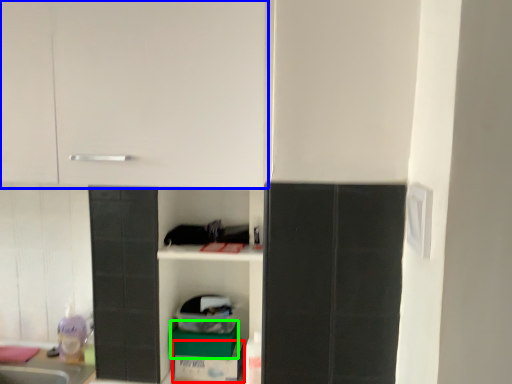
Question: Which object is positioned farthest from cardboard box (highlighted by a red box)? Select from cabinetry (highlighted by a blue box) and cardboard box (highlighted by a green box).

Choices:
 (A) cabinetry
 (B) cardboard box

Answer: (A)